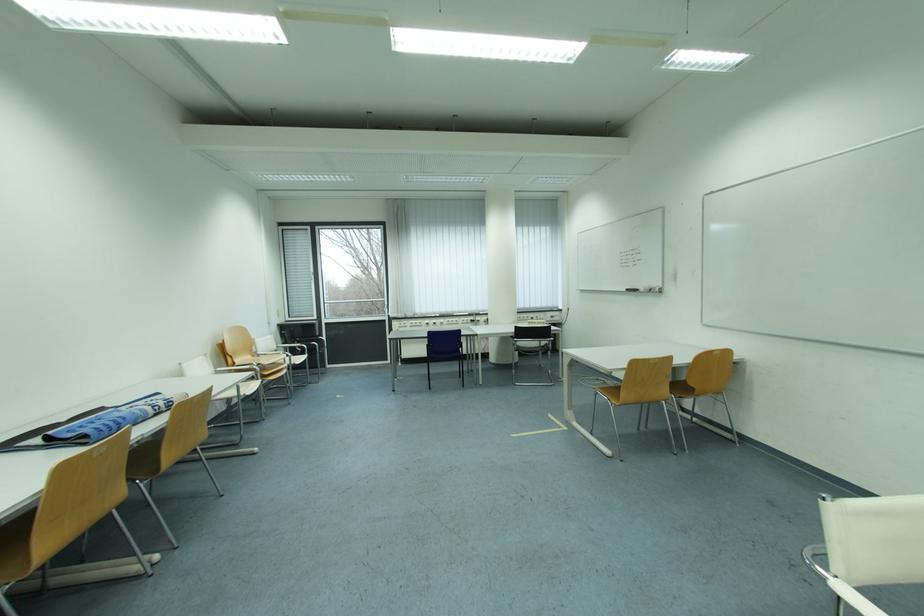
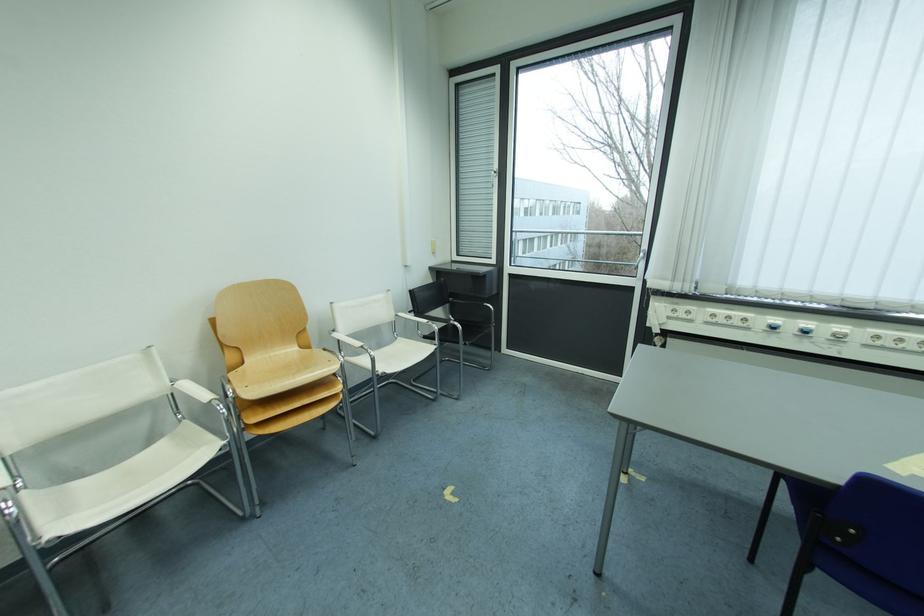
The point at (456, 326) is marked in the first image. Where is the corresponding point in the second image?

(874, 347)